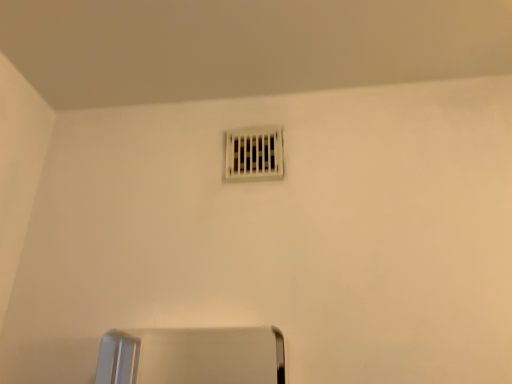
Question: Should I look upward or downward to see white plastic vent at upper center?

Choices:
 (A) up
 (B) down

Answer: (A)